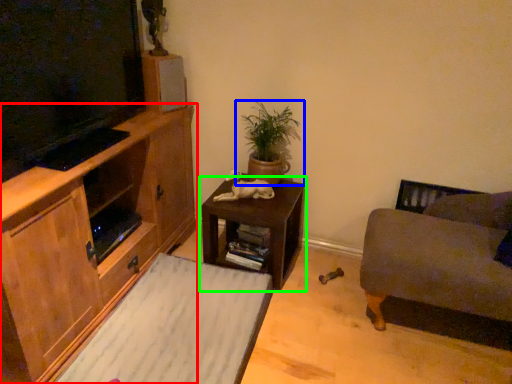
Question: Which object is the farthest from cabinetry (highlighted by a red box)? Choose among these: houseplant (highlighted by a blue box) or table (highlighted by a green box).

Choices:
 (A) houseplant
 (B) table

Answer: (A)